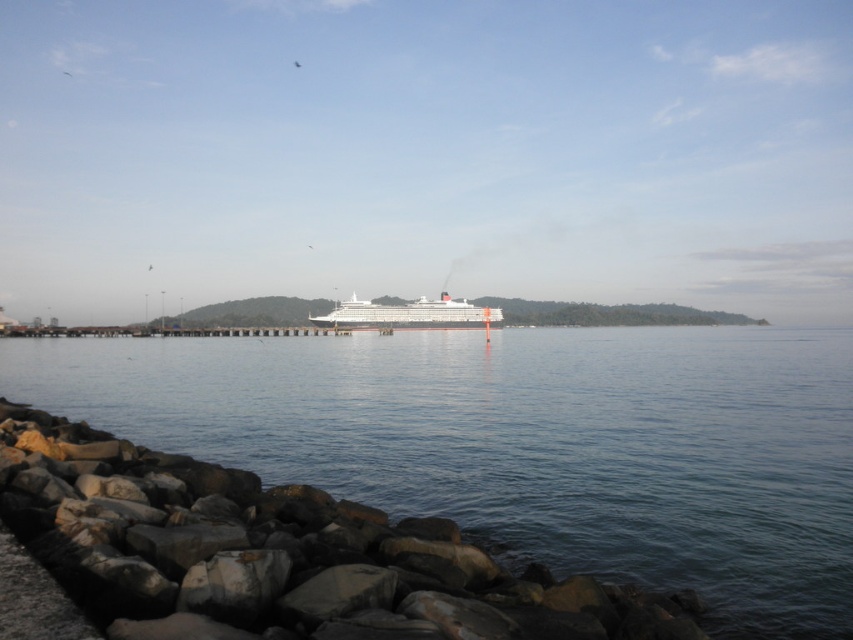
Question: Can you confirm if clear blue water at lower center is wider than white glossy cruise ship at center?

Choices:
 (A) no
 (B) yes

Answer: (B)

Question: Is clear blue water at lower center in front of white glossy cruise ship at center?

Choices:
 (A) yes
 (B) no

Answer: (A)

Question: Which point is farther to the camera?

Choices:
 (A) white glossy cruise ship at center
 (B) clear blue water at lower center

Answer: (A)

Question: Is clear blue water at lower center smaller than white glossy cruise ship at center?

Choices:
 (A) yes
 (B) no

Answer: (B)

Question: Which of the following is the closest to the observer?

Choices:
 (A) clear blue water at lower center
 (B) white glossy cruise ship at center

Answer: (A)